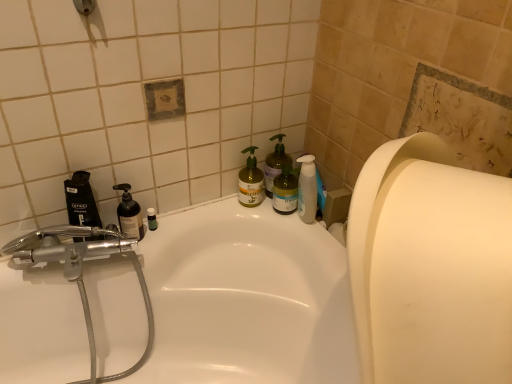
The image size is (512, 384). What are the coordinates of `vacant space that's between transparent plastic bottle at left and green matte pump bottle at upper right, positioned as the third cleaning product in left-to-right order` in the screenshot? It's located at (206, 216).